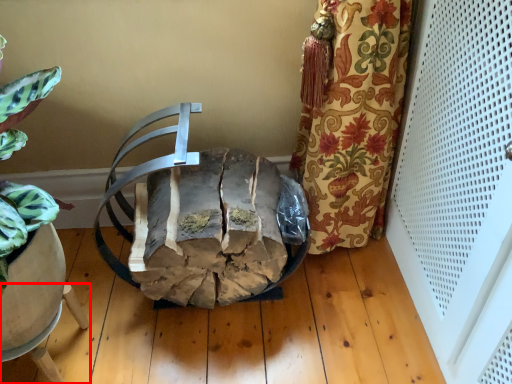
Question: From the image's perspective, where is furniture (annotated by the red box) located relative to chair?

Choices:
 (A) below
 (B) above

Answer: (A)